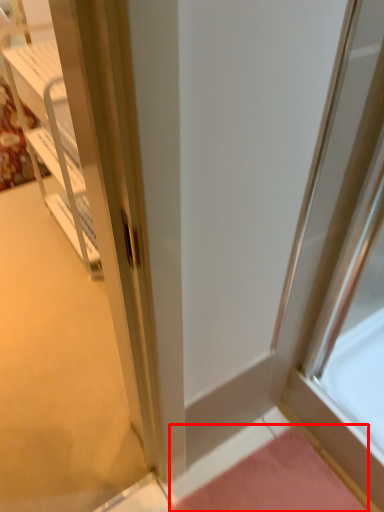
Question: From the image's perspective, where is doormat (annotated by the red box) located in relation to cabinetry in the image?

Choices:
 (A) below
 (B) above

Answer: (A)